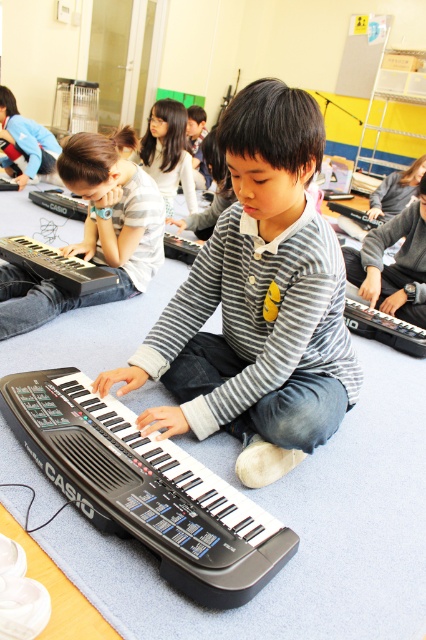
Question: Which object is the farthest from the gray striped shirt at center?

Choices:
 (A) black plastic keyboard at lower left
 (B) black plastic keyboard at center
 (C) matte black keyboard at lower left

Answer: (A)

Question: Considering the relative positions of matte black keyboard at lower left and black plastic keyboard at lower left in the image provided, where is matte black keyboard at lower left located with respect to black plastic keyboard at lower left?

Choices:
 (A) below
 (B) above

Answer: (B)

Question: Which of these objects is positioned farthest from the black plastic keyboard at center?

Choices:
 (A) matte black keyboard at lower left
 (B) black plastic keyboard at lower left
 (C) gray striped shirt at center

Answer: (B)

Question: Does gray striped shirt at center have a lesser width compared to black plastic keyboard at lower left?

Choices:
 (A) no
 (B) yes

Answer: (A)

Question: Does gray striped shirt at center have a lesser width compared to black plastic keyboard at lower left?

Choices:
 (A) yes
 (B) no

Answer: (B)

Question: Which point is closer to the camera taking this photo?

Choices:
 (A) 172,499
 (B) 336,256

Answer: (A)